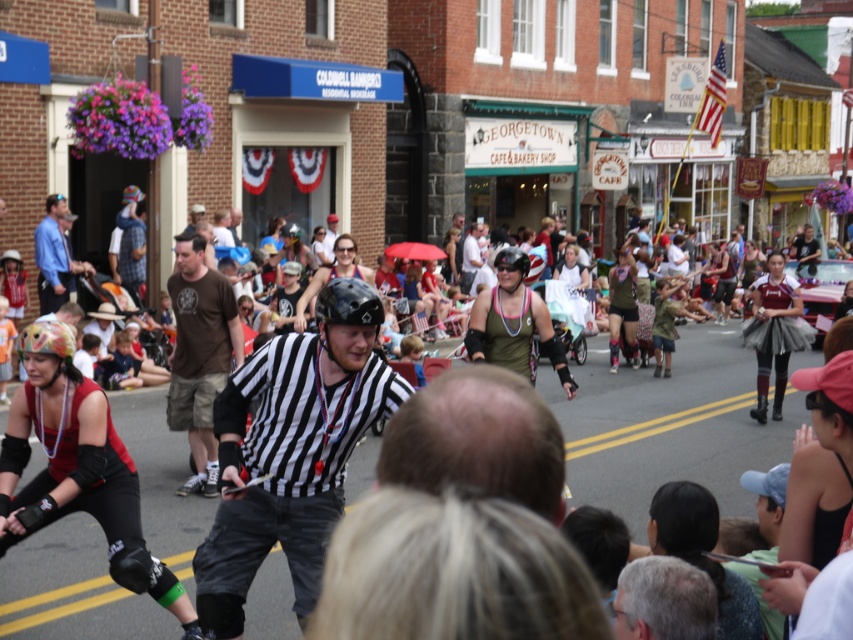
Based on the scene description, what is located at the coordinates point (x=291, y=451)?

The black striped shirt at center is located at point (x=291, y=451).